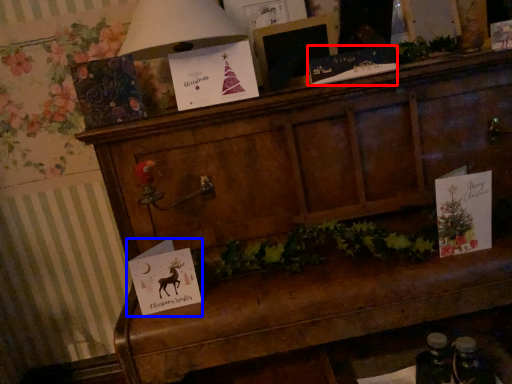
Question: Which object appears farthest to the camera in this image, christmas card (highlighted by a red box) or christmas card (highlighted by a blue box)?

Choices:
 (A) christmas card
 (B) christmas card

Answer: (A)